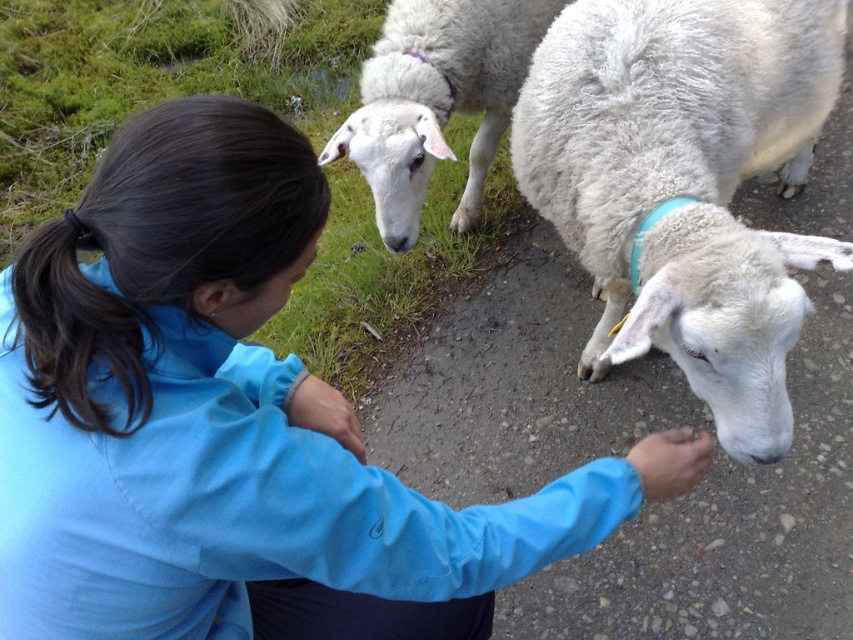
Question: Which of the following is the closest to the observer?

Choices:
 (A) white woolen sheep at center
 (B) dark brown silky hair at upper left

Answer: (B)

Question: Can you confirm if blue fabric jacket at center is thinner than white woolen sheep at center?

Choices:
 (A) no
 (B) yes

Answer: (A)

Question: Observing the image, what is the correct spatial positioning of blue fabric jacket at center in reference to white woolen sheep at upper center?

Choices:
 (A) right
 (B) left

Answer: (B)

Question: Among these objects, which one is nearest to the camera?

Choices:
 (A) dark brown silky hair at upper left
 (B) blue fabric jacket at center
 (C) white woolen sheep at upper center

Answer: (A)

Question: Which is nearer to the blue fabric jacket at center?

Choices:
 (A) dark brown silky hair at upper left
 (B) white woolen sheep at upper center

Answer: (A)

Question: Can you confirm if blue fabric jacket at center is positioned to the right of white woolen sheep at upper center?

Choices:
 (A) yes
 (B) no

Answer: (B)